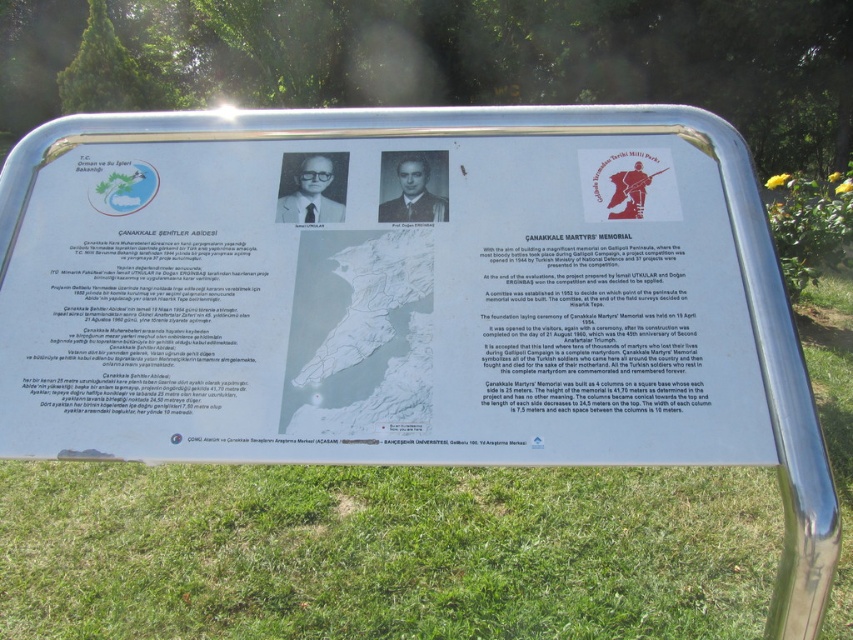
Does point (340, 272) come behind point (664, 570)?

No, (340, 272) is closer to viewer.

Does silver metallic sign at center appear over green grass at lower center?

Correct, silver metallic sign at center is located above green grass at lower center.

Which is in front, point (370, 269) or point (44, 628)?

Point (370, 269) is in front.

Where is `silver metallic sign at center`? silver metallic sign at center is located at coordinates (379, 300).